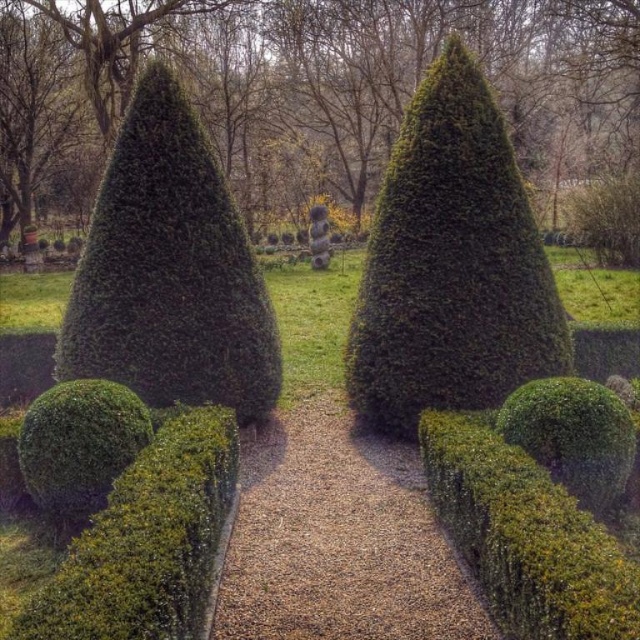
Question: Does green leafy shrub at left appear over green leafy hedge at lower left?

Choices:
 (A) no
 (B) yes

Answer: (B)

Question: Which object is positioned closest to the green textured hedge at center?

Choices:
 (A) green leafy bush at center
 (B) green leafy shrub at left

Answer: (B)

Question: Can you confirm if green leafy bush at center is positioned above green leafy hedge at lower left?

Choices:
 (A) yes
 (B) no

Answer: (A)

Question: Which object is farther from the camera taking this photo?

Choices:
 (A) green leafy bush at center
 (B) green leafy hedge at lower left
 (C) green textured hedge at center

Answer: (A)

Question: Is green leafy shrub at left above green matte sphere at lower left?

Choices:
 (A) no
 (B) yes

Answer: (B)

Question: Which object appears farthest from the camera in this image?

Choices:
 (A) green textured hedge at center
 (B) green leafy bush at center
 (C) green leafy hedge at lower left
 (D) green leafy shrub at left

Answer: (B)